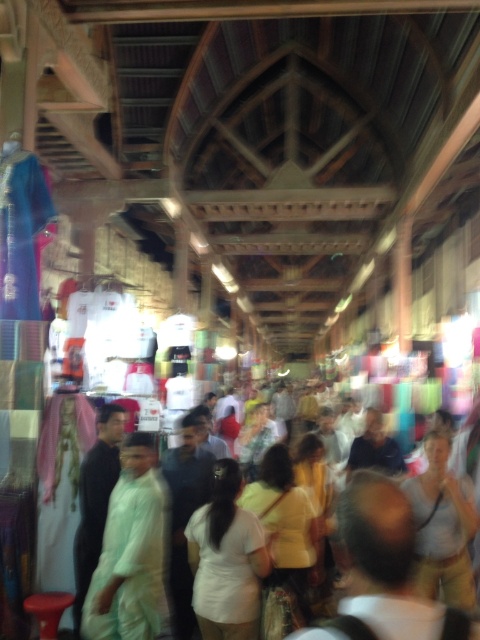
Find the location of a particular element. This screenshot has height=640, width=480. light green fabric at center is located at coordinates (131, 552).

The image size is (480, 640). What do you see at coordinates (131, 552) in the screenshot? I see `light green fabric at center` at bounding box center [131, 552].

Which is in front, point (122, 465) or point (231, 499)?

Point (231, 499) is in front.

This screenshot has height=640, width=480. In order to click on light green fabric at center in this screenshot , I will do `click(131, 552)`.

Is white cotton crowd at center further to camera compared to white matte shirt at center?

Yes, white cotton crowd at center is further from the viewer.

Can you confirm if white cotton crowd at center is thinner than white matte shirt at center?

No.

Is point (275, 445) more distant than point (217, 497)?

Yes, it is.

The image size is (480, 640). I want to click on white cotton crowd at center, so click(x=440, y=520).

Who is higher up, white cotton crowd at center or light green fabric at center?

light green fabric at center

From the picture: Between white cotton crowd at center and light green fabric at center, which one has less height?

white cotton crowd at center

Between point (285, 488) and point (122, 531), which one is positioned in front?

Positioned in front is point (122, 531).

Identify the location of white cotton crowd at center. This screenshot has width=480, height=640. (440, 520).